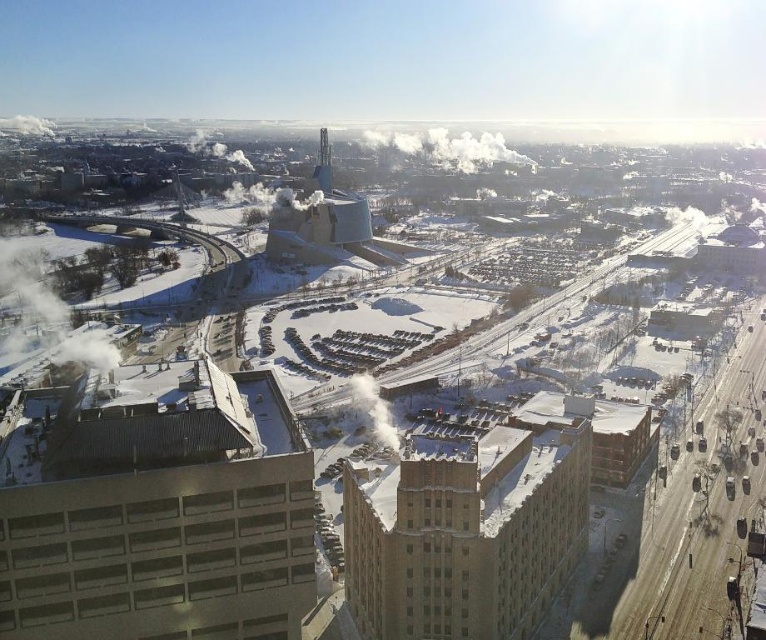
Question: Can you confirm if gray concrete building at lower left is wider than brown brick building at lower right?

Choices:
 (A) yes
 (B) no

Answer: (B)

Question: Can you confirm if gray concrete building at lower left is bigger than brown brick building at lower right?

Choices:
 (A) no
 (B) yes

Answer: (A)

Question: Which point is farther to the camera?

Choices:
 (A) brown brick building at lower right
 (B) gray concrete building at lower left

Answer: (A)

Question: Is gray concrete building at lower left to the left of brown brick building at lower right from the viewer's perspective?

Choices:
 (A) no
 (B) yes

Answer: (B)

Question: Which point appears farthest from the camera in this image?

Choices:
 (A) [25, 577]
 (B) [362, 588]

Answer: (B)